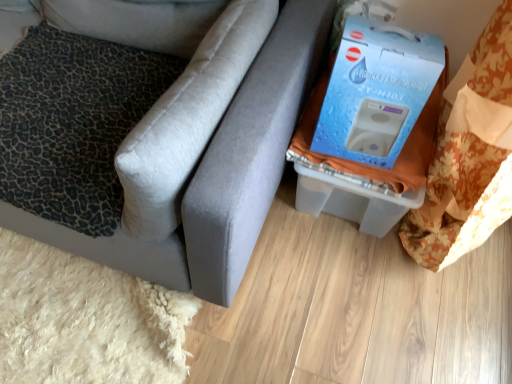
Question: Is matte gray couch at lower right taller or shorter than leopard print fabric pillow at left, acting as the 1th pillow starting from the bottom?

Choices:
 (A) tall
 (B) short

Answer: (A)

Question: Would you say matte gray couch at lower right is inside or outside leopard print fabric pillow at left, acting as the 1th pillow starting from the bottom?

Choices:
 (A) inside
 (B) outside

Answer: (B)

Question: Estimate the real-world distances between objects in this image. Which object is farther from the leopard print cushion at left, positioned as the first pillow in top-to-bottom order?

Choices:
 (A) leopard print fabric pillow at left, which ranks as the second pillow in top-to-bottom order
 (B) matte gray couch at lower right

Answer: (B)

Question: Based on their relative distances, which object is nearer to the leopard print cushion at left, positioned as the first pillow in top-to-bottom order?

Choices:
 (A) leopard print fabric pillow at left, acting as the 1th pillow starting from the bottom
 (B) matte gray couch at lower right

Answer: (A)